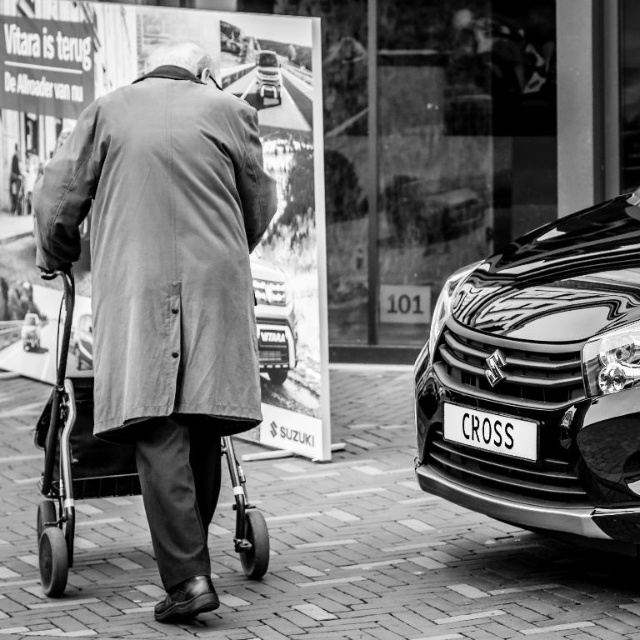
Is point (244, 348) in front of point (596, 262)?

Yes.

Who is positioned more to the right, matte gray coat at center or black glossy car at right?

black glossy car at right

Between point (156, 262) and point (506, 321), which one is positioned behind?

The point (506, 321) is more distant.

Locate an element on the screen. This screenshot has height=640, width=640. matte gray coat at center is located at coordinates (166, 289).

Between matte gray coat at center and white plastic license plate at lower right, which one is positioned lower?

white plastic license plate at lower right

Can you confirm if matte gray coat at center is positioned below white plastic license plate at lower right?

No, matte gray coat at center is not below white plastic license plate at lower right.

The image size is (640, 640). What do you see at coordinates (166, 289) in the screenshot?
I see `matte gray coat at center` at bounding box center [166, 289].

Where is `matte gray coat at center`? This screenshot has height=640, width=640. matte gray coat at center is located at coordinates (166, 289).

Between black glossy car at right and white plastic license plate at lower right, which one is positioned higher?

black glossy car at right is above.

Does black glossy car at right have a lesser width compared to white plastic license plate at lower right?

In fact, black glossy car at right might be wider than white plastic license plate at lower right.

Is point (484, 484) positioned after point (484, 433)?

That is True.

Image resolution: width=640 pixels, height=640 pixels. I want to click on black glossy car at right, so [540, 380].